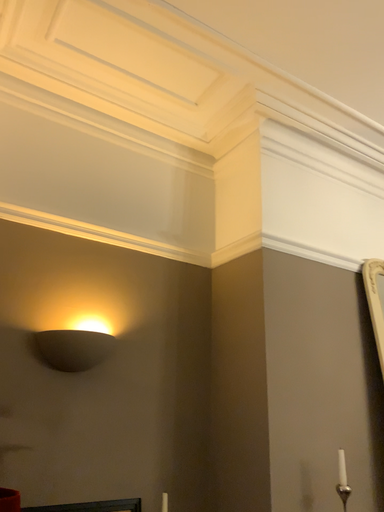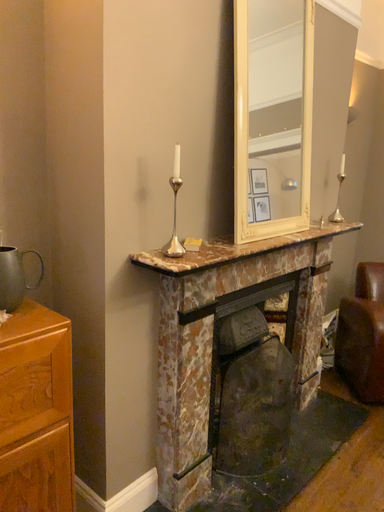
Question: Which way did the camera rotate in the video?

Choices:
 (A) rotated right
 (B) rotated left

Answer: (A)